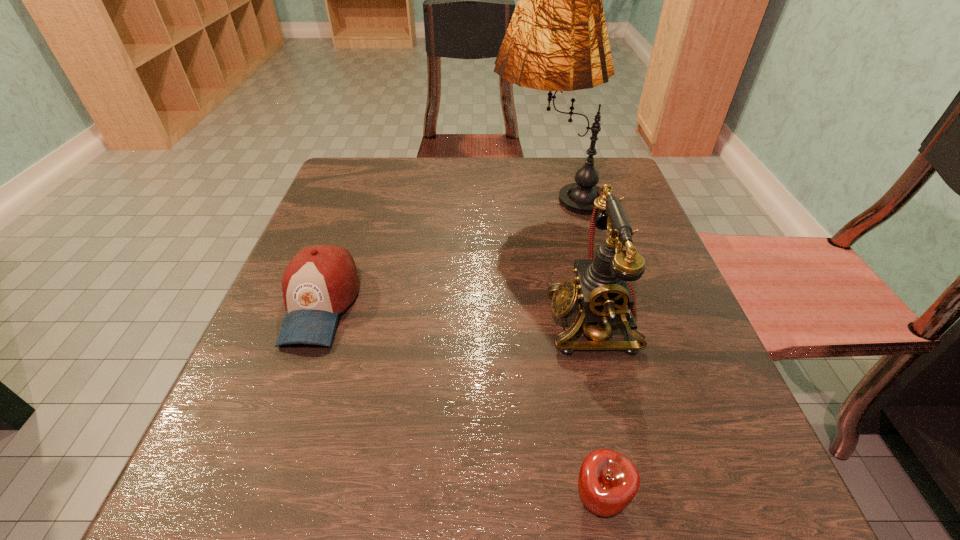
The width and height of the screenshot is (960, 540). In order to click on free space between the baseball cap and the lampshade in this screenshot , I will do `click(434, 250)`.

This screenshot has width=960, height=540. Identify the location of free point between the baseball cap and the tallest object. (434, 250).

Where is `object that is the third nearest to the baseball cap`? object that is the third nearest to the baseball cap is located at coordinates (608, 481).

Identify which object is the third nearest to the third shortest object. Please provide its 2D coordinates. Your answer should be formatted as a tuple, i.e. [(x, y)], where the tuple contains the x and y coordinates of a point satisfying the conditions above.

[(321, 281)]

Where is `free spot that satisfies the following two spatial constraints: 1. on the front of the telephone, featuring the rotary dial; 2. on the front side of the apple`? The height and width of the screenshot is (540, 960). free spot that satisfies the following two spatial constraints: 1. on the front of the telephone, featuring the rotary dial; 2. on the front side of the apple is located at coordinates (637, 500).

Identify the location of free location that satisfies the following two spatial constraints: 1. on the front-facing side of the apple; 2. on the right side of the baseball cap. Image resolution: width=960 pixels, height=540 pixels. (250, 500).

Where is `free location that satisfies the following two spatial constraints: 1. on the front-facing side of the baseball cap; 2. on the right side of the apple`? free location that satisfies the following two spatial constraints: 1. on the front-facing side of the baseball cap; 2. on the right side of the apple is located at coordinates (250, 500).